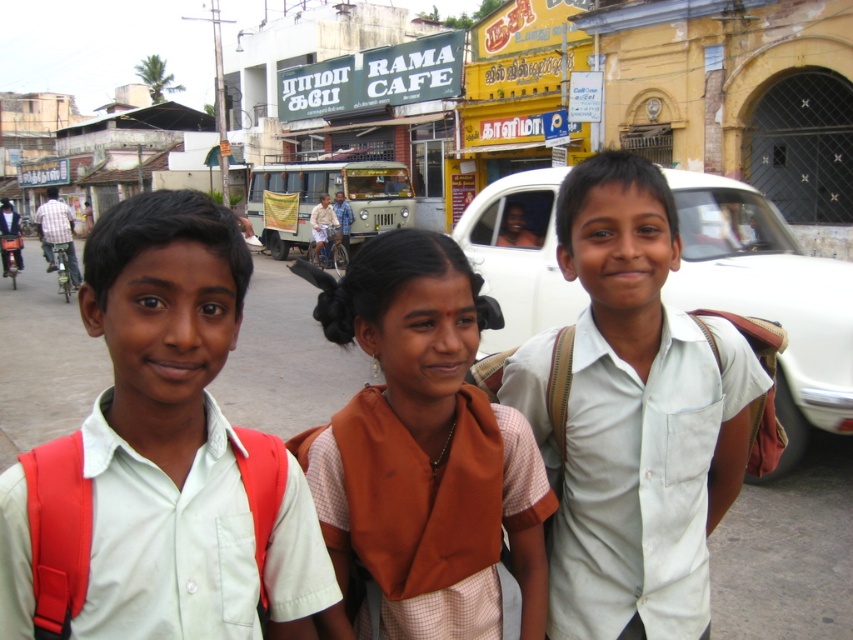
Looking at this image, is orange fabric sari at center shorter than white matte car at center?

Yes, orange fabric sari at center is shorter than white matte car at center.

Does orange fabric sari at center lie behind white matte car at center?

No, orange fabric sari at center is in front of white matte car at center.

Locate an element on the screen. The image size is (853, 640). orange fabric sari at center is located at coordinates coord(426,445).

Describe the element at coordinates (165, 424) in the screenshot. I see `light green shirt at center` at that location.

Is light green shirt at center shorter than white matte car at center?

Yes, light green shirt at center is shorter than white matte car at center.

Where is `light green shirt at center`? The image size is (853, 640). light green shirt at center is located at coordinates (165, 424).

Does point (158, 227) come closer to viewer compared to point (631, 406)?

Yes, point (158, 227) is closer to viewer.

Does light green shirt at center appear over white cotton shirt at center?

Indeed, light green shirt at center is positioned over white cotton shirt at center.

Where is `light green shirt at center`? This screenshot has height=640, width=853. light green shirt at center is located at coordinates (165, 424).